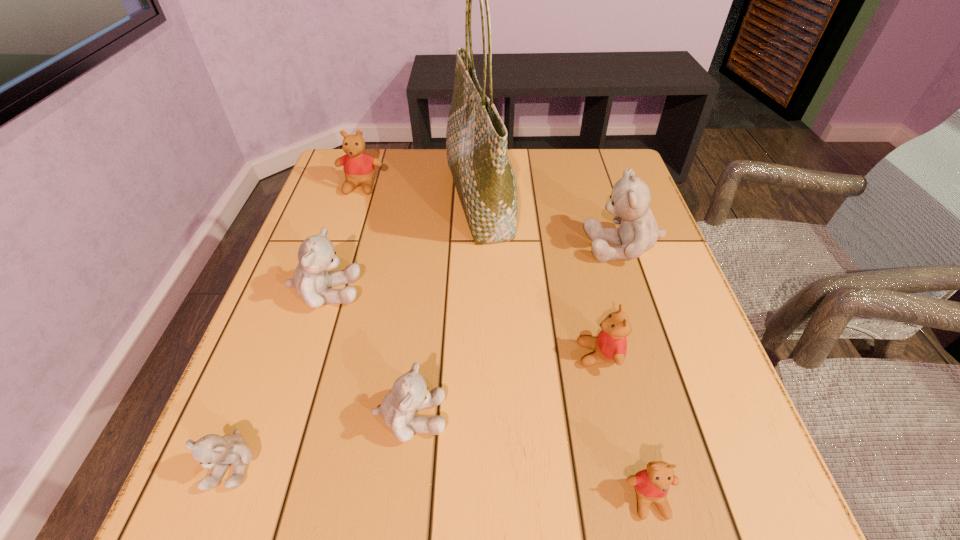
Point out which gray teddy bear is positioned as the nearest to the shopping bag. Please provide its 2D coordinates. Your answer should be formatted as a tuple, i.e. [(x, y)], where the tuple contains the x and y coordinates of a point satisfying the conditions above.

[(629, 202)]

Locate which red teddy bear ranks in proximity to the smallest gray teddy bear. Please provide its 2D coordinates. Your answer should be formatted as a tuple, i.e. [(x, y)], where the tuple contains the x and y coordinates of a point satisfying the conditions above.

[(610, 346)]

Identify the location of red teddy bear that is the closest to the second biggest gray teddy bear. (358, 166).

Locate an element on the screen. This screenshot has width=960, height=540. free space that satisfies the following two spatial constraints: 1. on the face of the second gray teddy bear from right to left; 2. on the face of the smallest gray teddy bear is located at coordinates (405, 463).

Locate an element on the screen. Image resolution: width=960 pixels, height=540 pixels. vacant point that satisfies the following two spatial constraints: 1. on the face of the third nearest gray teddy bear; 2. on the face of the smallest gray teddy bear is located at coordinates (270, 463).

Locate an element on the screen. vacant area in the image that satisfies the following two spatial constraints: 1. on the front-facing side of the second biggest red teddy bear; 2. on the face of the smallest gray teddy bear is located at coordinates (623, 463).